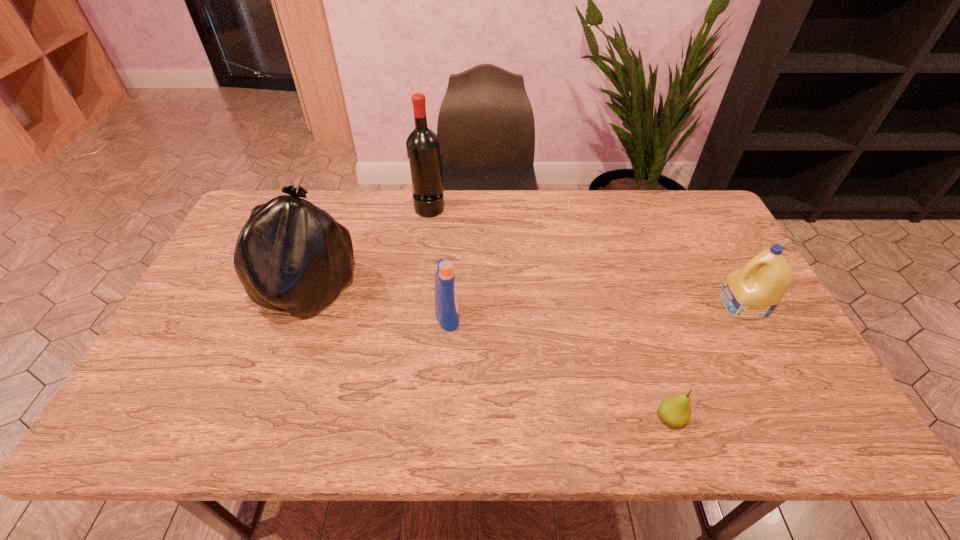
Where is `vacant point located between the second tallest object and the third object from right to left`? The image size is (960, 540). vacant point located between the second tallest object and the third object from right to left is located at coordinates (376, 303).

Where is `unoccupied area between the third object from left to right and the shortest object`? unoccupied area between the third object from left to right and the shortest object is located at coordinates (560, 367).

The image size is (960, 540). I want to click on unoccupied area between the tallest object and the right detergent, so click(x=586, y=256).

This screenshot has height=540, width=960. Find the location of `free spot between the right detergent and the leftmost object`. free spot between the right detergent and the leftmost object is located at coordinates (524, 299).

Locate an element on the screen. This screenshot has width=960, height=540. object that stands as the third closest to the nearest object is located at coordinates (291, 255).

The image size is (960, 540). I want to click on the closest object relative to the left detergent, so click(291, 255).

Identify the location of vacant point that satisfies the following two spatial constraints: 1. on the front side of the nearest object; 2. on the left side of the leftmost object. (259, 419).

This screenshot has height=540, width=960. Find the location of `free space in the image that satisfies the following two spatial constraints: 1. on the front side of the farthest object; 2. on the left side of the pear`. free space in the image that satisfies the following two spatial constraints: 1. on the front side of the farthest object; 2. on the left side of the pear is located at coordinates (402, 419).

The image size is (960, 540). I want to click on free region that satisfies the following two spatial constraints: 1. on the label of the third object from left to right; 2. on the right side of the nearest object, so click(x=441, y=419).